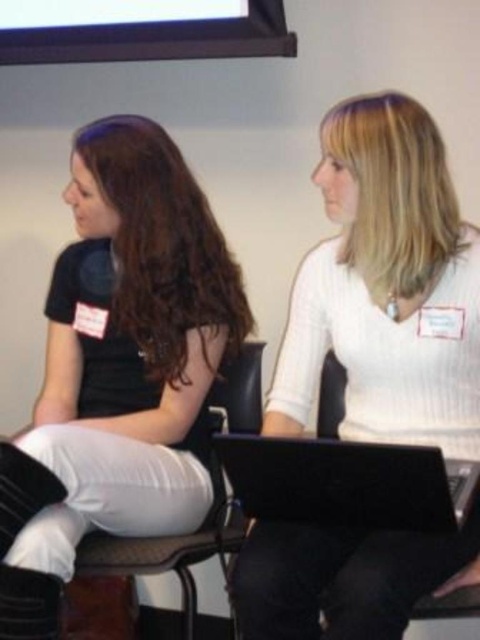
You are a photographer setting up for a group photo. You need to position the matte black shirt at left and the black matte laptop at center so that the laptop is centered between the two people. Is the current arrangement correct?

The matte black shirt at left is to the left of the black matte laptop at center, so the laptop is already positioned to the right of the shirt. To center it between the two people, the laptop should be equidistant from both, but currently, it is closer to the shirt. Therefore, the current arrangement is not correct.

You are taking a photo of two people sitting on a couch. The first person is at point (9, 531) and the second is at point (330, 392). Which person will appear larger in the photo?

The person at point (9, 531) will appear larger in the photo because it is closer to the camera than point (330, 392).

You are a photographer trying to capture a portrait of both the matte black shirt at left and the black plastic chair at lower center. Since you want to ensure both subjects are in focus, you need to know which one is taller. Can you determine which object is taller?

The matte black shirt at left is taller than the black plastic chair at lower center according to the description.